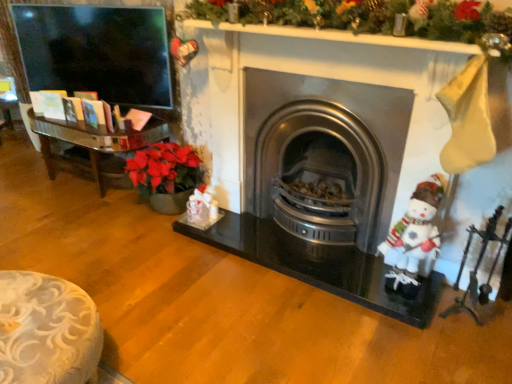
The width and height of the screenshot is (512, 384). I want to click on vacant area that is in front of metallic silver fireplace tools at right, so click(x=474, y=354).